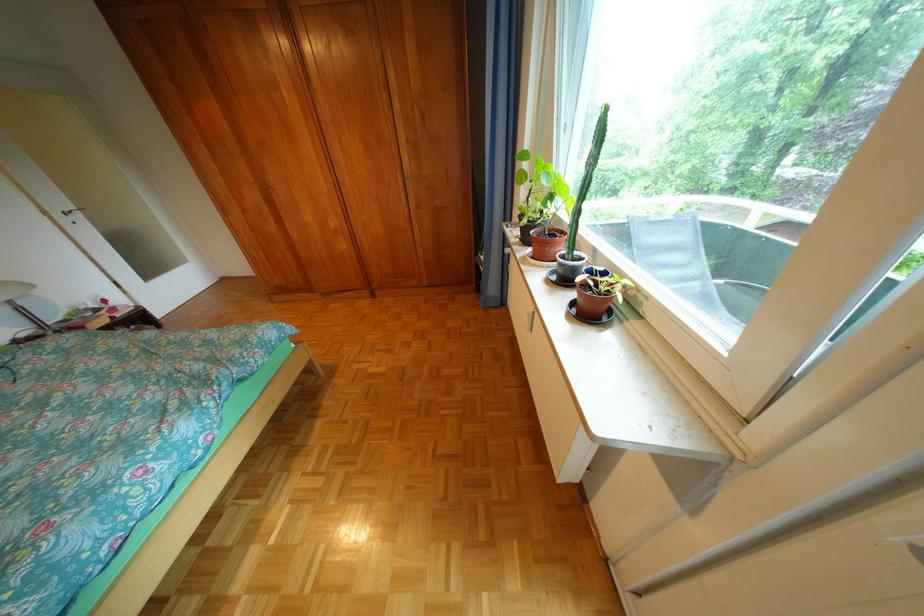
You are a GUI agent. You are given a task and a screenshot of the screen. Output one action in this format:
    pyautogui.click(x=<x>, y=<y>)
    Task: Click on the white window frame
    
    Given the screenshot: What is the action you would take?
    pyautogui.click(x=731, y=361)